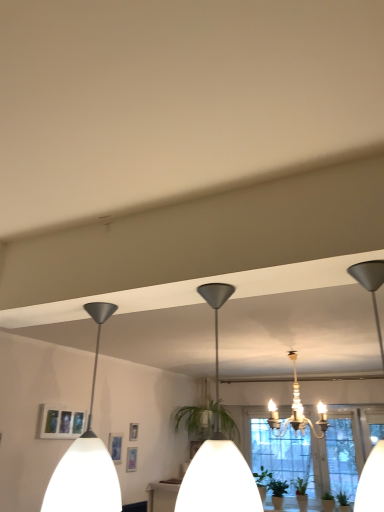
Question: Does white matte pendant light at left, arranged as the third lamp when viewed from the right, have a greater height compared to matte white picture frame at lower left?

Choices:
 (A) yes
 (B) no

Answer: (A)

Question: Is white matte pendant light at left, which is counted as the first lamp, starting from the left, next to matte white picture frame at lower left?

Choices:
 (A) yes
 (B) no

Answer: (B)

Question: Is white matte pendant light at left, the second lamp when ordered from back to front, in front of matte white picture frame at lower left?

Choices:
 (A) no
 (B) yes

Answer: (B)

Question: From a real-world perspective, is white matte pendant light at left, which is counted as the second lamp, starting from the front, located beneath matte white picture frame at lower left?

Choices:
 (A) no
 (B) yes

Answer: (A)

Question: Does white matte pendant light at left, the second lamp when ordered from back to front, lie behind matte white picture frame at lower left?

Choices:
 (A) no
 (B) yes

Answer: (A)

Question: In terms of height, does white matte pendant light at left, arranged as the third lamp when viewed from the right, look taller or shorter compared to clear glass window at center?

Choices:
 (A) tall
 (B) short

Answer: (B)

Question: Considering the positions of point (99, 318) and point (352, 459), is point (99, 318) closer or farther from the camera than point (352, 459)?

Choices:
 (A) farther
 (B) closer

Answer: (B)

Question: Is white matte pendant light at left, the second lamp when ordered from back to front, wider or thinner than clear glass window at center?

Choices:
 (A) wide
 (B) thin

Answer: (A)

Question: Is white matte pendant light at left, which is counted as the second lamp, starting from the front, situated inside clear glass window at center or outside?

Choices:
 (A) outside
 (B) inside

Answer: (A)

Question: From a real-world perspective, relative to white matte pendant light at left, which is counted as the first lamp, starting from the left, is matte black pendant light at center, which ranks as the second lamp in right-to-left order, vertically above or below?

Choices:
 (A) above
 (B) below

Answer: (A)

Question: Is matte black pendant light at center, which ranks as the second lamp in right-to-left order, inside the boundaries of white matte pendant light at left, the second lamp when ordered from back to front, or outside?

Choices:
 (A) outside
 (B) inside

Answer: (A)

Question: In terms of width, does matte black pendant light at center, marked as the third lamp in a back-to-front arrangement, look wider or thinner when compared to white matte pendant light at left, which is counted as the second lamp, starting from the front?

Choices:
 (A) wide
 (B) thin

Answer: (A)

Question: Is matte black pendant light at center, which is the 1th lamp in front-to-back order, taller or shorter than white matte pendant light at left, the second lamp when ordered from back to front?

Choices:
 (A) tall
 (B) short

Answer: (B)

Question: From a real-world perspective, is matte black pendant light at center, which ranks as the second lamp in right-to-left order, above or below white crystal chandelier at center, acting as the first lamp starting from the back?

Choices:
 (A) above
 (B) below

Answer: (B)

Question: Visually, is matte black pendant light at center, marked as the third lamp in a back-to-front arrangement, positioned to the left or to the right of white crystal chandelier at center, which is the 1th lamp in right-to-left order?

Choices:
 (A) left
 (B) right

Answer: (A)